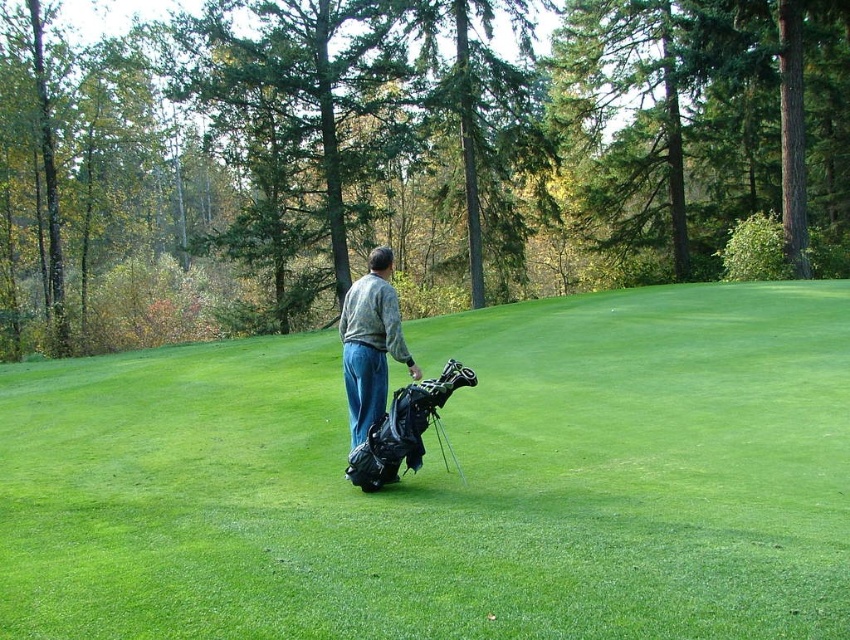
You are a golfer who wants to hit a ball from the green grassy field at center to the trees in the background. Considering the metallic silver golf club at center is partially visible, can you estimate if the grass is tall enough to interfere with your swing?

The green grassy field at center is much taller than the metallic silver golf club at center, so the grass is likely tall enough to interfere with your swing.

You are a photographer setting up a shot of the scene. The camouflage jacket at center and metallic silver golf club at center are both in the frame. If you want to ensure both items are fully visible without cropping, which item requires more horizontal space in the frame?

The camouflage jacket at center requires more horizontal space in the frame because it might be wider than the metallic silver golf club at center.